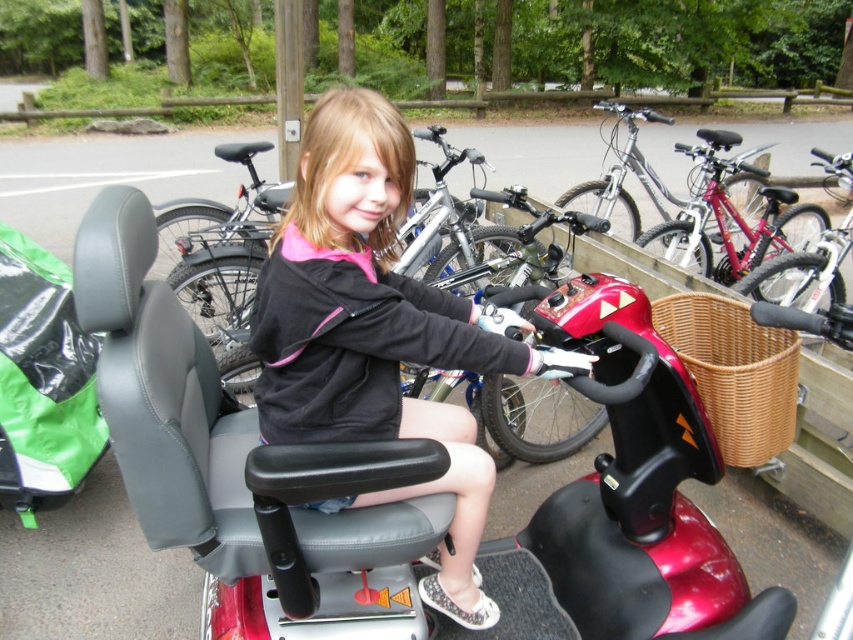
Does shiny red scooter at center have a greater width compared to shiny red bicycle at center?

Incorrect, shiny red scooter at center's width does not surpass shiny red bicycle at center's.

Which of these two, shiny red scooter at center or shiny red bicycle at center, stands shorter?

Standing shorter between the two is shiny red bicycle at center.

Between point (170, 401) and point (773, 234), which one is positioned behind?

Positioned behind is point (773, 234).

The width and height of the screenshot is (853, 640). What are the coordinates of `shiny red scooter at center` in the screenshot? It's located at (408, 483).

Is shiny red scooter at center to the right of black leather jacket at center from the viewer's perspective?

Indeed, shiny red scooter at center is positioned on the right side of black leather jacket at center.

Does point (268, 508) lie in front of point (328, 225)?

Yes, point (268, 508) is closer to viewer.

Measure the distance between point (x=247, y=468) and camera.

Point (x=247, y=468) is 1.34 meters from camera.

In order to click on shiny red scooter at center in this screenshot , I will do `click(408, 483)`.

Who is taller, black leather jacket at center or shiny red bicycle at center?

With more height is black leather jacket at center.

I want to click on black leather jacket at center, so 378,332.

Locate an element on the screen. The height and width of the screenshot is (640, 853). black leather jacket at center is located at coordinates (378, 332).